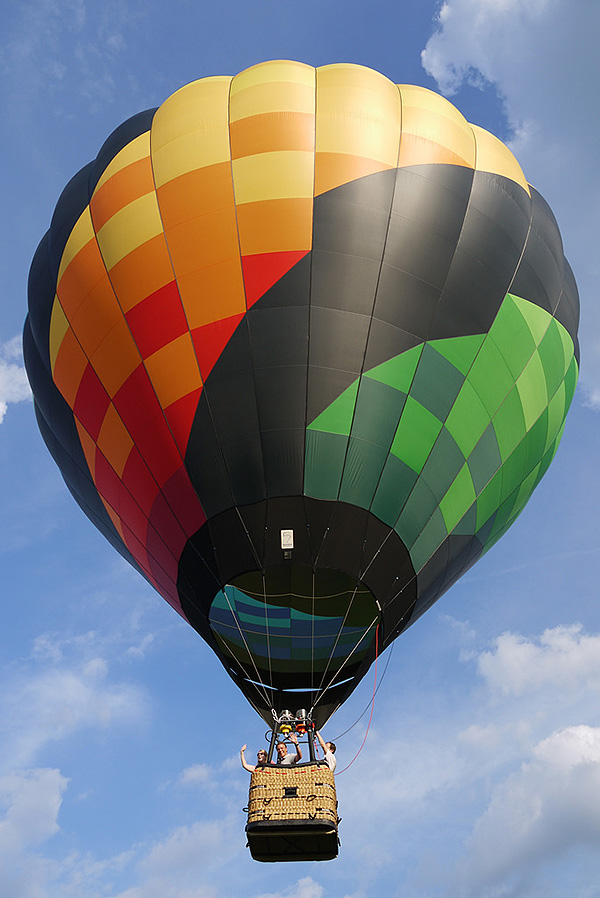
Image resolution: width=600 pixels, height=898 pixels. I want to click on canopy, so click(x=246, y=147).